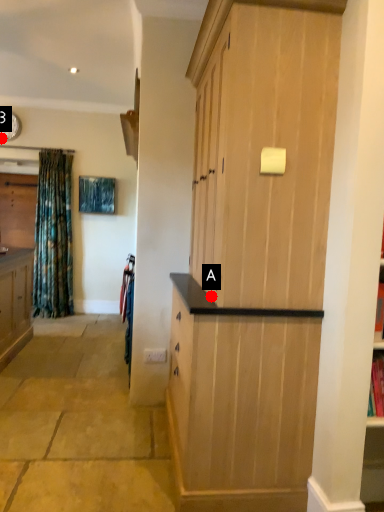
Question: Two points are circled on the image, labeled by A and B beside each circle. Which point is closer to the camera?

Choices:
 (A) A is closer
 (B) B is closer

Answer: (A)